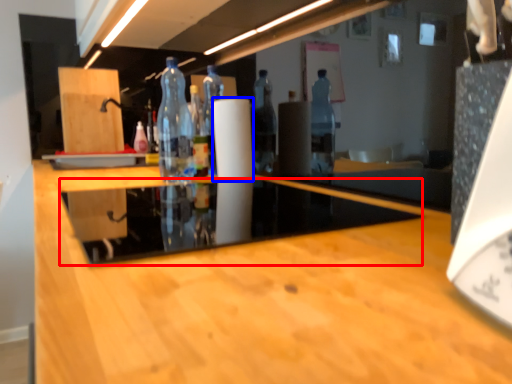
Question: Which point is further to the camera, glass table (highlighted by a red box) or paper towel (highlighted by a blue box)?

Choices:
 (A) glass table
 (B) paper towel

Answer: (B)